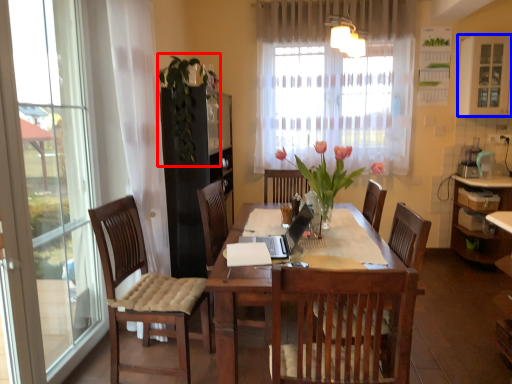
Question: Among these objects, which one is nearest to the camera, floral arrangement (highlighted by a red box) or window (highlighted by a blue box)?

Choices:
 (A) floral arrangement
 (B) window

Answer: (A)